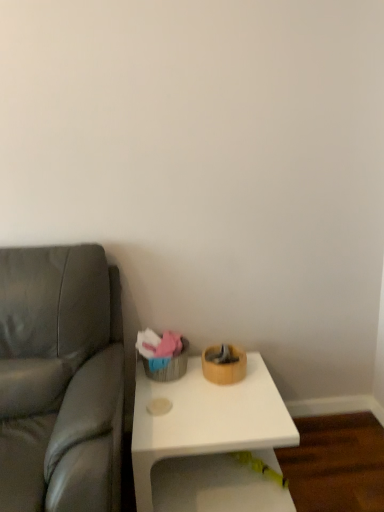
Question: Would you say white matte table at center is to the left or to the right of suede gray couch at left in the picture?

Choices:
 (A) right
 (B) left

Answer: (A)

Question: From the image's perspective, is white matte table at center located above or below suede gray couch at left?

Choices:
 (A) above
 (B) below

Answer: (B)

Question: Is white matte table at center spatially inside suede gray couch at left, or outside of it?

Choices:
 (A) outside
 (B) inside

Answer: (A)

Question: Is suede gray couch at left in front of or behind white matte table at center in the image?

Choices:
 (A) front
 (B) behind

Answer: (A)

Question: From the image's perspective, is suede gray couch at left located above or below white matte table at center?

Choices:
 (A) above
 (B) below

Answer: (A)

Question: Based on their sizes in the image, would you say suede gray couch at left is bigger or smaller than white matte table at center?

Choices:
 (A) small
 (B) big

Answer: (B)

Question: In terms of width, does suede gray couch at left look wider or thinner when compared to white matte table at center?

Choices:
 (A) wide
 (B) thin

Answer: (A)